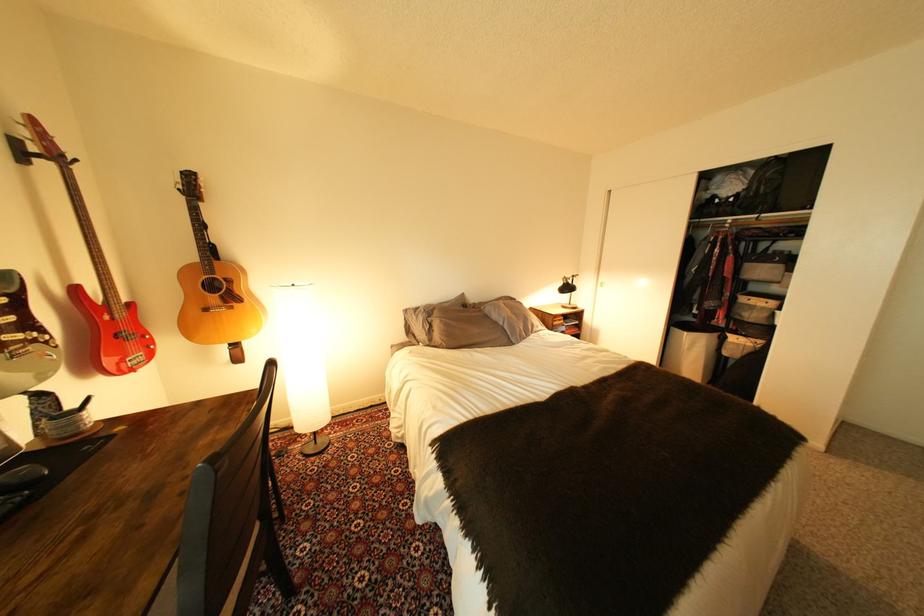
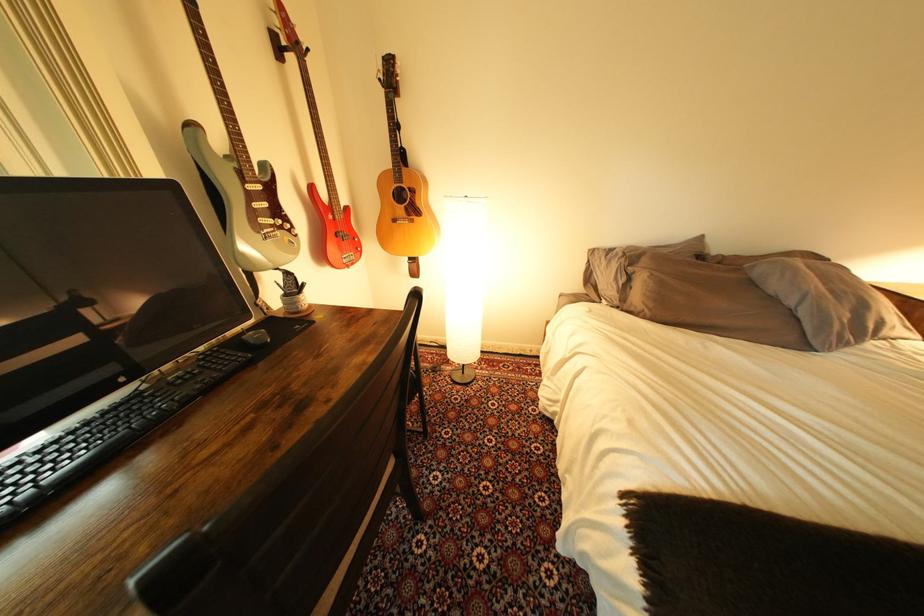
The point at (497, 309) is marked in the first image. Where is the corresponding point in the second image?

(767, 268)